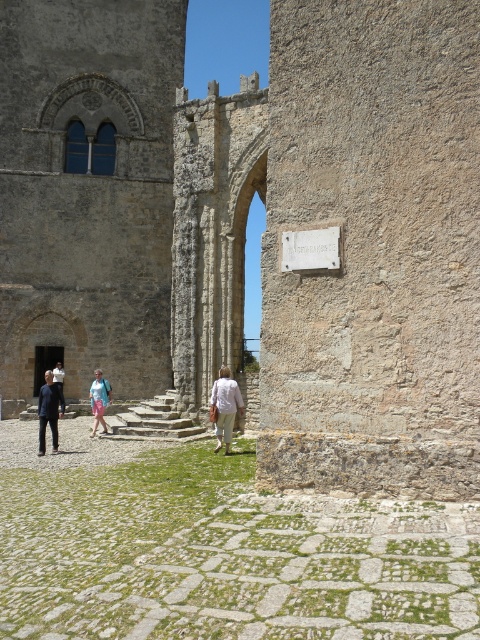
You are a tour guide standing at the entrance of the historical site. You notice a visitor is looking at the dark blue shirt at lower left and wants to read the white stone plaque at center. Which direction should they move to reach the plaque from their current position?

The visitor should move to the right since the white stone plaque at center is located to the right of the dark blue shirt at lower left.

You are a tourist visiting this historical site and notice two shirts in the scene. The white cotton shirt at center and the dark blue shirt at lower left. Which shirt is closer to the large arched doorway?

The white cotton shirt at center is positioned under the dark blue shirt at lower left, which means it is closer to the large arched doorway since it is lower in the image.

You are a tour guide leading a group to the entrance of the historical site. You notice the white stone plaque at center and the dark blue shirt at lower left. Which object takes up more area in the image?

The dark blue shirt at lower left occupies more space than the white stone plaque at center.